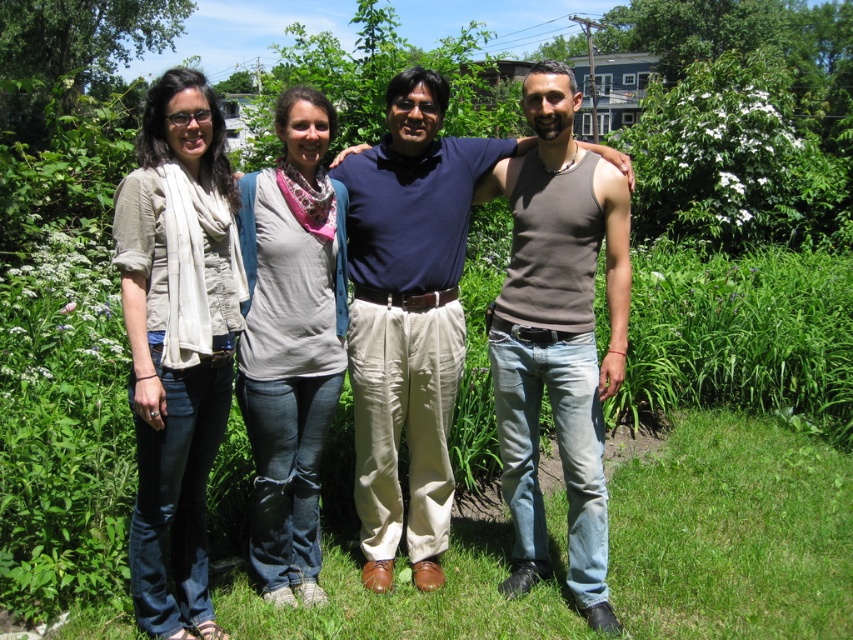
You are a photographer standing at the origin point of the coordinate system. You want to take a photo of the gray cotton shirt at center. What are the coordinates where you should aim your camera?

The gray cotton shirt at center is located at coordinates point (291,340). Therefore, you should aim your camera at point (291,340) to capture the gray cotton shirt at center.